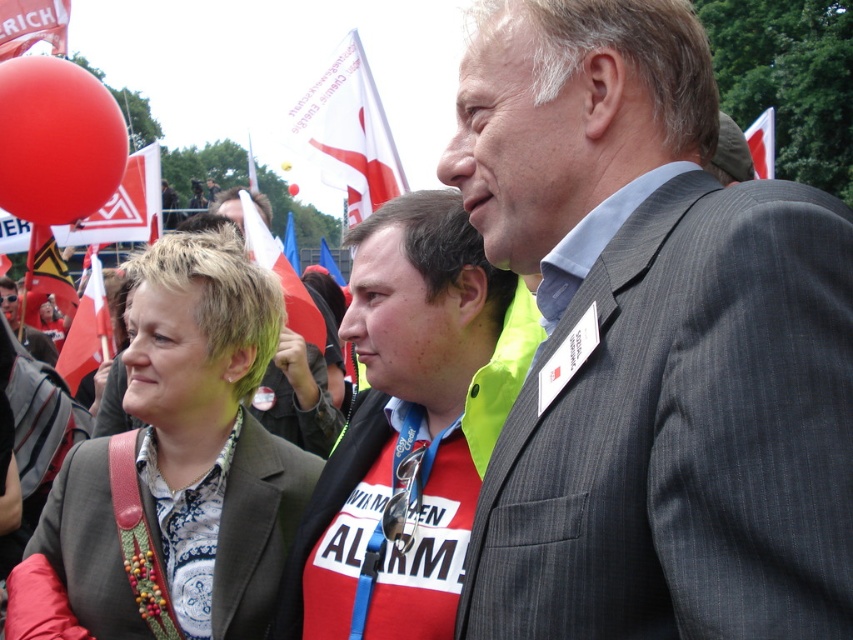
Is the position of matte gray blazer at center less distant than that of rubber balloon at upper left?

Yes, it is.

What do you see at coordinates (173, 468) in the screenshot?
I see `matte gray blazer at center` at bounding box center [173, 468].

The width and height of the screenshot is (853, 640). I want to click on matte gray blazer at center, so click(x=173, y=468).

Image resolution: width=853 pixels, height=640 pixels. I want to click on matte gray blazer at center, so click(173, 468).

The height and width of the screenshot is (640, 853). What do you see at coordinates (651, 346) in the screenshot?
I see `gray pinstripe suit at center` at bounding box center [651, 346].

Who is taller, gray pinstripe suit at center or matte black jacket at center?

Standing taller between the two is gray pinstripe suit at center.

Is point (645, 381) in front of point (13, 323)?

Yes, it is.

At what (x,y) coordinates should I click in order to perform the action: click on gray pinstripe suit at center. Please return your answer as a coordinate pair (x, y). Looking at the image, I should click on (651, 346).

Between point (230, 384) and point (454, 449), which one is positioned in front?

Point (454, 449)

Can you confirm if matte gray blazer at center is smaller than red shirt at center?

No.

Locate an element on the screen. The height and width of the screenshot is (640, 853). matte gray blazer at center is located at coordinates (173, 468).